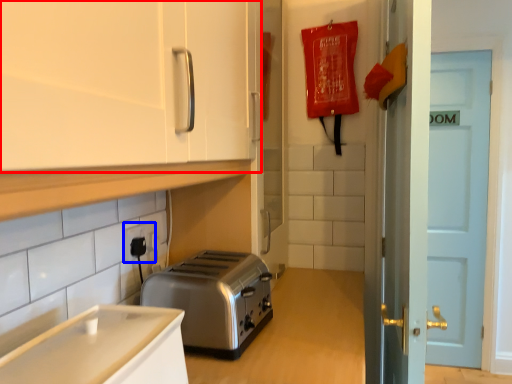
Question: Which of the following is the closest to the observer, cabinetry (highlighted by a red box) or electric outlet (highlighted by a blue box)?

Choices:
 (A) cabinetry
 (B) electric outlet

Answer: (A)